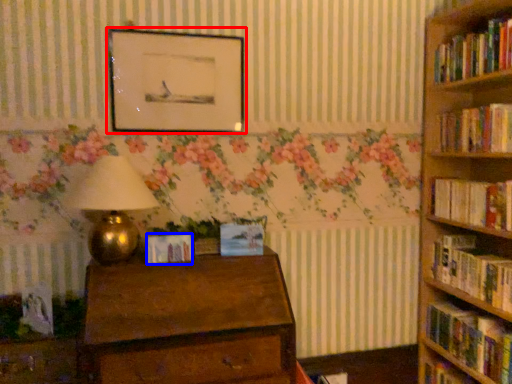
Question: Which point is closer to the camera, picture frame (highlighted by a red box) or paperback book (highlighted by a blue box)?

Choices:
 (A) picture frame
 (B) paperback book

Answer: (B)